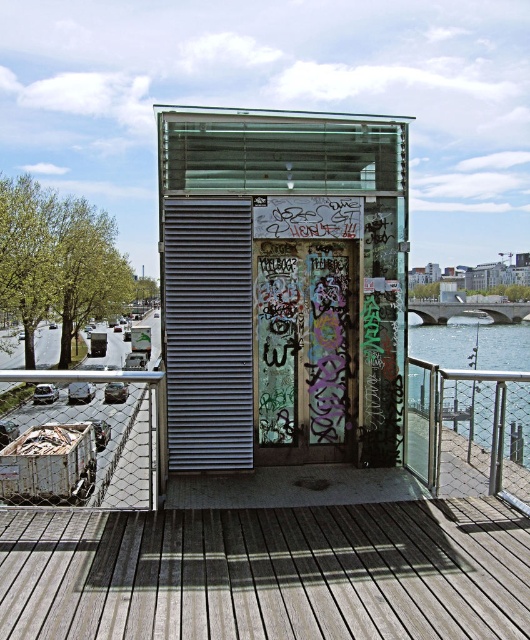
Is wooden planks at center taller than clear water at lower right?

In fact, wooden planks at center may be shorter than clear water at lower right.

Is point (419, 592) positioned after point (444, 336)?

No, (419, 592) is closer to viewer.

Between point (29, 547) and point (416, 349), which one is positioned in front?

Point (29, 547) is in front.

Locate an element on the screen. The image size is (530, 640). wooden planks at center is located at coordinates (268, 572).

Which is more to the left, metallic glass bus stop at center or wooden planks at center?

Positioned to the left is wooden planks at center.

Does metallic glass bus stop at center have a lesser width compared to wooden planks at center?

Indeed, metallic glass bus stop at center has a lesser width compared to wooden planks at center.

What do you see at coordinates (282, 285) in the screenshot?
I see `metallic glass bus stop at center` at bounding box center [282, 285].

What are the coordinates of `metallic glass bus stop at center` in the screenshot? It's located at (282, 285).

Is metallic glass bus stop at center thinner than rusty metal shipping container at lower left?

Yes.

Between point (201, 371) and point (0, 468), which one is positioned behind?

The point (0, 468) is more distant.

This screenshot has width=530, height=640. I want to click on metallic glass bus stop at center, so click(x=282, y=285).